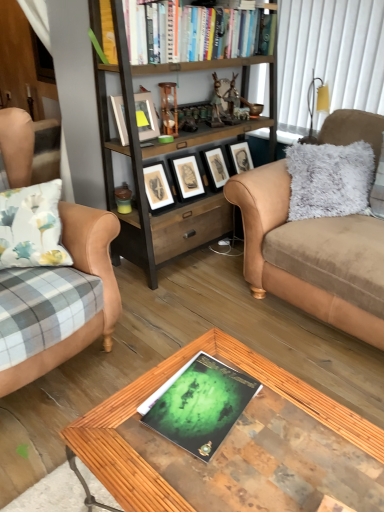
You are a GUI agent. You are given a task and a screenshot of the screen. Output one action in this format:
    pyautogui.click(x=<x>, y=<y>)
    Task: Click on the vacant space positioned to the left of green matte magazine at center
    The image size is (384, 512).
    Given the screenshot: What is the action you would take?
    pyautogui.click(x=118, y=424)